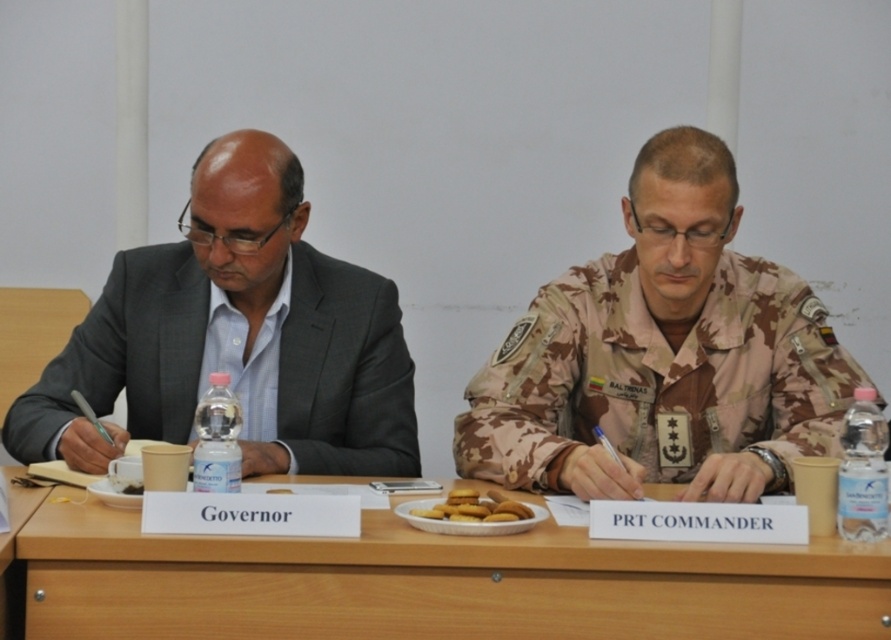
How much distance is there between camouflage fabric uniform at center and wooden table at lower left?

camouflage fabric uniform at center is 1.14 meters away from wooden table at lower left.

Which is more to the right, camouflage fabric uniform at center or wooden table at lower left?

From the viewer's perspective, camouflage fabric uniform at center appears more on the right side.

Locate an element on the screen. This screenshot has height=640, width=891. camouflage fabric uniform at center is located at coordinates (661, 355).

Is matte gray suit at left smaller than golden matte cookies at center?

No.

Which is in front, point (67, 403) or point (505, 500)?

Positioned in front is point (505, 500).

Between point (227, 342) and point (495, 508), which one is positioned in front?

Point (495, 508)

I want to click on matte gray suit at left, so click(236, 337).

Does wooden table at lower left have a lesser width compared to golden matte cookies at center?

In fact, wooden table at lower left might be wider than golden matte cookies at center.

The height and width of the screenshot is (640, 891). Identify the location of wooden table at lower left. 15,561.

At what (x,y) coordinates should I click in order to perform the action: click on wooden table at lower left. Please return your answer as a coordinate pair (x, y). Looking at the image, I should click on (15, 561).